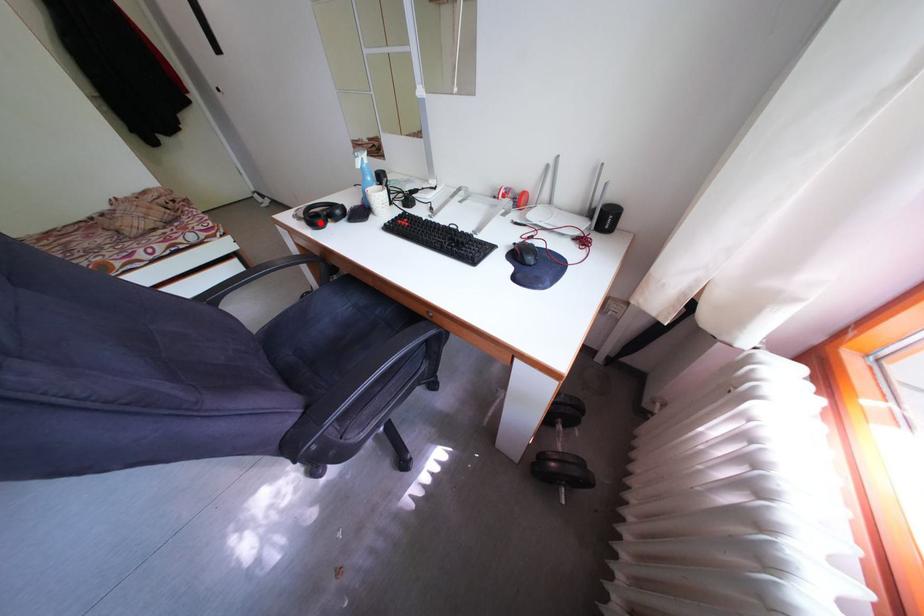
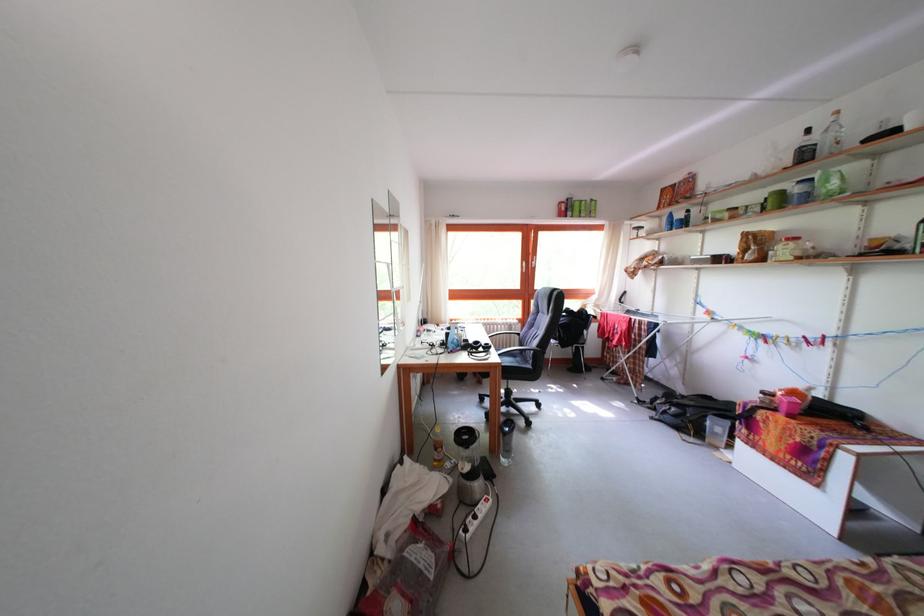
In the second image, find the point that corresponds to the highlighted location in the first image.

(495, 353)